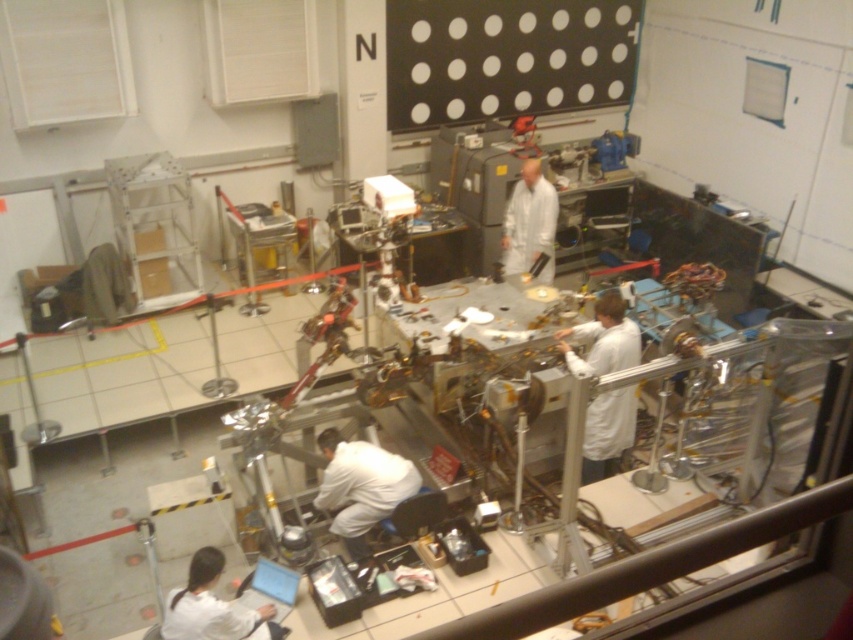
Question: Can you confirm if white lab coat at right is positioned below white matte lab coat at lower center?

Choices:
 (A) yes
 (B) no

Answer: (B)

Question: Which point is farther to the camera?

Choices:
 (A) (340, 440)
 (B) (525, 161)
 (C) (605, 323)

Answer: (B)

Question: Does white lab coat at right have a larger size compared to white lab coat at lower left?

Choices:
 (A) no
 (B) yes

Answer: (B)

Question: Is white lab coat at lower left further to camera compared to white matte lab coat at center?

Choices:
 (A) yes
 (B) no

Answer: (B)

Question: Which point is closer to the camera taking this photo?

Choices:
 (A) 538,237
 (B) 611,296

Answer: (B)

Question: Considering the real-world distances, which object is farthest from the white lab coat at lower left?

Choices:
 (A) white lab coat at right
 (B) white matte lab coat at lower center

Answer: (A)